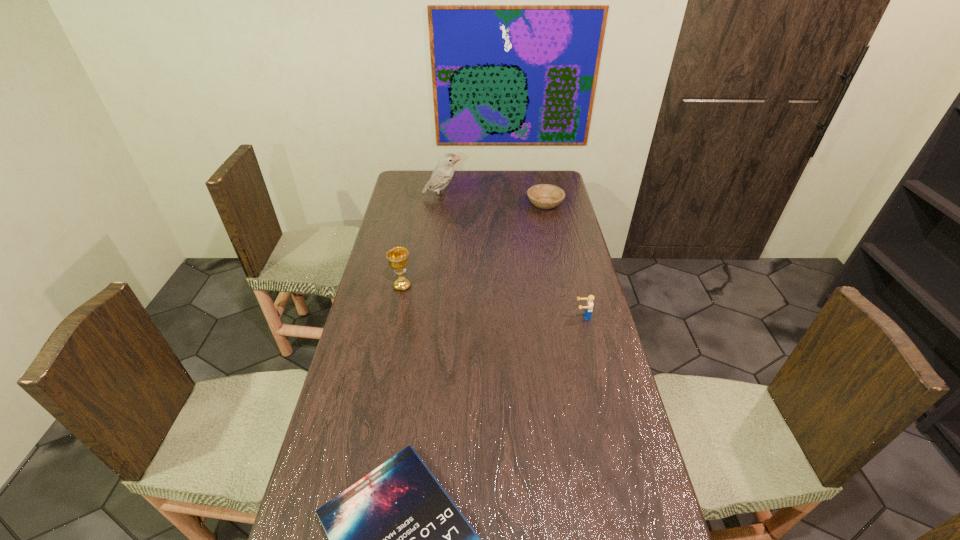
Find the location of a particular element. blank space at the right edge of the desktop is located at coordinates (592, 357).

Image resolution: width=960 pixels, height=540 pixels. I want to click on empty space between the fourth shortest object and the bowl, so click(x=473, y=245).

Where is `vacant space in between the second tallest object and the bird`? vacant space in between the second tallest object and the bird is located at coordinates (422, 242).

This screenshot has height=540, width=960. Identify the location of vacant region between the Lego and the bowl. (564, 260).

The image size is (960, 540). Find the location of `vacant area that lies between the third farthest object and the tallest object`. vacant area that lies between the third farthest object and the tallest object is located at coordinates (422, 242).

Locate an element on the screen. free area in between the chalice and the Lego is located at coordinates (492, 301).

Identify the location of empty space between the third farthest object and the tallest object. (422, 242).

Identify the location of object that ranks as the third closest to the third farthest object. (396, 539).

Identify which object is the fourth closest to the shortest object. Please provide its 2D coordinates. Your answer should be formatted as a tuple, i.e. [(x, y)], where the tuple contains the x and y coordinates of a point satisfying the conditions above.

[(444, 171)]

Find the location of a particular element. This screenshot has width=960, height=540. free spot that satisfies the following two spatial constraints: 1. at the face of the second shortest object; 2. on the right side of the bird is located at coordinates (442, 204).